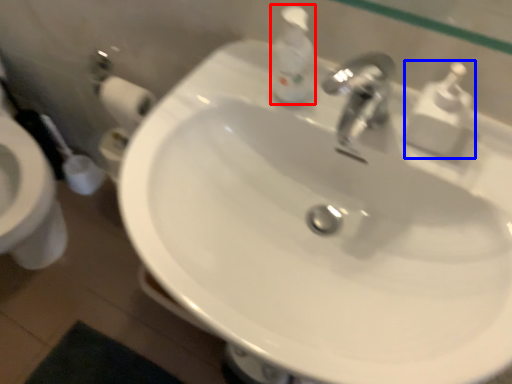
Question: Which object is closer to the camera taking this photo, soap dispenser (highlighted by a red box) or soap dispenser (highlighted by a blue box)?

Choices:
 (A) soap dispenser
 (B) soap dispenser

Answer: (B)